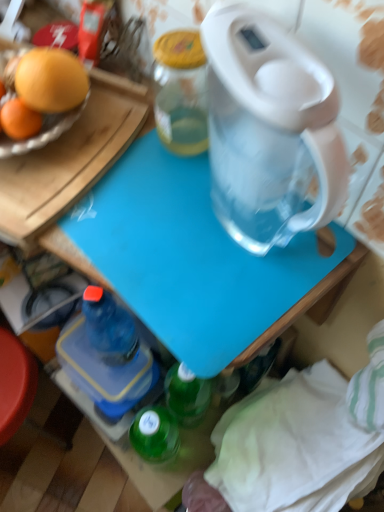
This screenshot has height=512, width=384. What do you see at coordinates (109, 328) in the screenshot?
I see `blue plastic bottle at lower left` at bounding box center [109, 328].

What is the approximate width of blue plastic bottle at lower left?

8.54 inches.

Locate an element on the screen. This screenshot has width=384, height=512. blue plastic bottle at lower left is located at coordinates (109, 328).

Based on the photo, what is the approximate height of blue plastic bottle at lower left?

It is 3.54 inches.

Locate an element on the screen. This screenshot has height=512, width=384. blue plastic cutting board at center is located at coordinates 196,261.

What do you see at coordinates (196, 261) in the screenshot?
I see `blue plastic cutting board at center` at bounding box center [196, 261].

Image resolution: width=384 pixels, height=512 pixels. In order to click on blue plastic bottle at lower left in this screenshot , I will do point(109,328).

Which object is positioned more to the right, blue plastic bottle at lower left or blue plastic cutting board at center?

blue plastic cutting board at center.

Is blue plastic bottle at lower left closer to the viewer compared to blue plastic cutting board at center?

No.

Is point (97, 328) closer to camera compared to point (145, 232)?

No.

From the image's perspective, which one is positioned higher, blue plastic bottle at lower left or blue plastic cutting board at center?

blue plastic cutting board at center is shown above in the image.

From a real-world perspective, who is located higher, blue plastic bottle at lower left or blue plastic cutting board at center?

From a 3D spatial view, blue plastic cutting board at center is above.

Looking at this image, considering the relative sizes of blue plastic bottle at lower left and blue plastic cutting board at center in the image provided, is blue plastic bottle at lower left wider than blue plastic cutting board at center?

Correct, the width of blue plastic bottle at lower left exceeds that of blue plastic cutting board at center.

Can you confirm if blue plastic bottle at lower left is shorter than blue plastic cutting board at center?

Correct, blue plastic bottle at lower left is not as tall as blue plastic cutting board at center.

Is blue plastic bottle at lower left bigger or smaller than blue plastic cutting board at center?

blue plastic bottle at lower left is smaller than blue plastic cutting board at center.

Is blue plastic bottle at lower left positioned beyond the bounds of blue plastic cutting board at center?

Yes, blue plastic bottle at lower left is outside of blue plastic cutting board at center.

Is blue plastic bottle at lower left beside blue plastic cutting board at center?

No, blue plastic bottle at lower left is not with blue plastic cutting board at center.

Is blue plastic cutting board at center at the back of blue plastic bottle at lower left?

No, blue plastic bottle at lower left's orientation is not away from blue plastic cutting board at center.

Can you tell me how much blue plastic bottle at lower left and blue plastic cutting board at center differ in facing direction?

There is a 86.2-degree angle between the facing directions of blue plastic bottle at lower left and blue plastic cutting board at center.

The width and height of the screenshot is (384, 512). There is a blue plastic bottle at lower left. Find the location of `table above it (from a real-world perspective)`. table above it (from a real-world perspective) is located at coordinates (196, 261).

Is blue plastic cutting board at center to the left of blue plastic bottle at lower left from the viewer's perspective?

No.

Is blue plastic cutting board at center in front of or behind blue plastic bottle at lower left in the image?

In the image, blue plastic cutting board at center appears in front of blue plastic bottle at lower left.

Is point (333, 258) positioned in front of point (119, 343)?

Yes, it is in front of point (119, 343).

From the image's perspective, is blue plastic cutting board at center under blue plastic bottle at lower left?

Incorrect, from the image's perspective, blue plastic cutting board at center is higher than blue plastic bottle at lower left.

From a real-world perspective, is blue plastic cutting board at center below blue plastic bottle at lower left?

No, from a real-world perspective, blue plastic cutting board at center is not below blue plastic bottle at lower left.

Between blue plastic cutting board at center and blue plastic bottle at lower left, which one has smaller width?

With smaller width is blue plastic cutting board at center.

Between blue plastic cutting board at center and blue plastic bottle at lower left, which one has more height?

blue plastic cutting board at center.

Can you confirm if blue plastic cutting board at center is bigger than blue plastic bottle at lower left?

Correct, blue plastic cutting board at center is larger in size than blue plastic bottle at lower left.

Is blue plastic bottle at lower left inside blue plastic cutting board at center?

No, blue plastic bottle at lower left is located outside of blue plastic cutting board at center.

Is blue plastic cutting board at center directly adjacent to blue plastic bottle at lower left?

No, blue plastic cutting board at center is not making contact with blue plastic bottle at lower left.

Is blue plastic cutting board at center positioned with its back to blue plastic bottle at lower left?

No, blue plastic cutting board at center's orientation is not away from blue plastic bottle at lower left.

Based on the photo, what's the angular difference between blue plastic cutting board at center and blue plastic bottle at lower left's facing directions?

The angle between the facing direction of blue plastic cutting board at center and the facing direction of blue plastic bottle at lower left is 86.2 degrees.

Locate an element on the screen. bottle to the left of blue plastic cutting board at center is located at coordinates (109, 328).

What are the coordinates of `table that is above the blue plastic bottle at lower left (from the image's perspective)` in the screenshot? It's located at (196, 261).

At what (x,y) coordinates should I click in order to perform the action: click on bottle that is under the blue plastic cutting board at center (from a real-world perspective). Please return your answer as a coordinate pair (x, y). This screenshot has width=384, height=512. Looking at the image, I should click on [x=109, y=328].